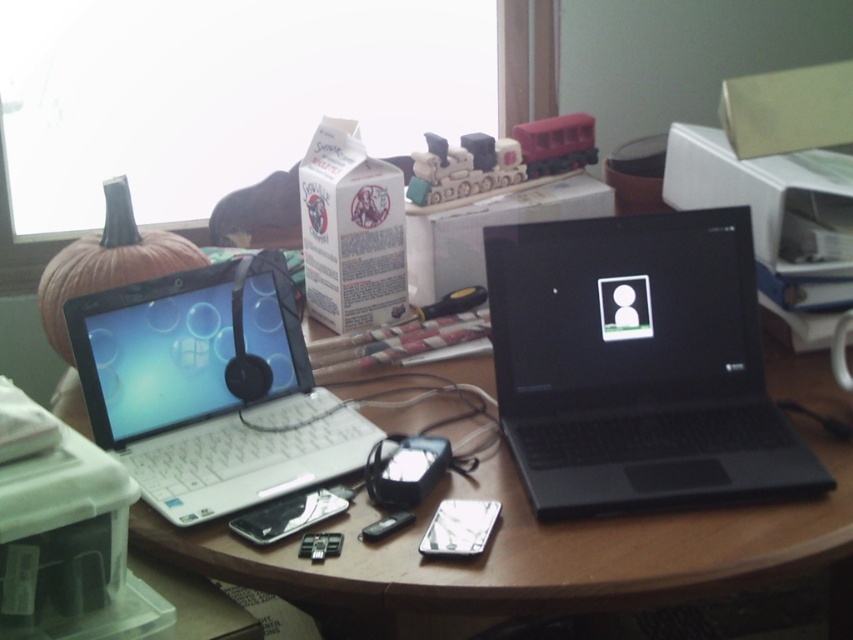
Please look at the desk and find the point located at coordinates (636,364). Which object is this point on?

The point at coordinates (636,364) is on the black matte laptop at center.

You are organizing the desk and want to place a new item between the black matte laptop at center and the white plastic laptop at left. Is there enough space between them for the item?

The black matte laptop at center is positioned on the right side of white plastic laptop at left, so there is space between them to place the new item.